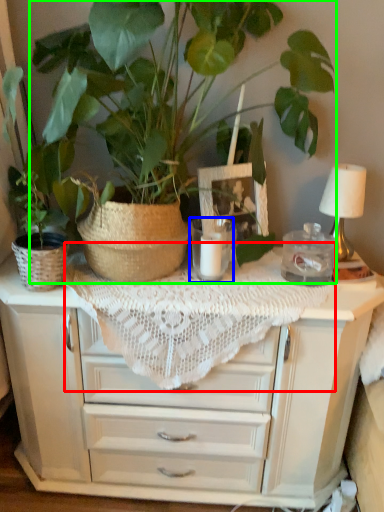
Question: Which object is the closest to the tablecloth (highlighted by a red box)? Choose among these: candle holder (highlighted by a blue box) or houseplant (highlighted by a green box).

Choices:
 (A) candle holder
 (B) houseplant

Answer: (A)